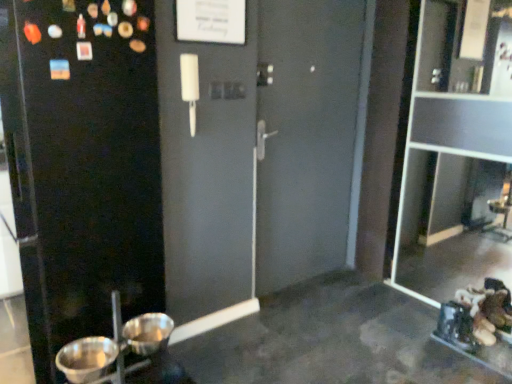
Question: From the image's perspective, does metallic silver basin at lower left, which ranks as the first basin in right-to-left order, appear lower than transparent glass cabinet at right?

Choices:
 (A) yes
 (B) no

Answer: (A)

Question: Is metallic silver basin at lower left, the second basin from the left, oriented away from transparent glass cabinet at right?

Choices:
 (A) yes
 (B) no

Answer: (B)

Question: Is metallic silver basin at lower left, which ranks as the first basin in right-to-left order, far from transparent glass cabinet at right?

Choices:
 (A) yes
 (B) no

Answer: (A)

Question: Is metallic silver basin at lower left, which ranks as the first basin in right-to-left order, at the right side of transparent glass cabinet at right?

Choices:
 (A) no
 (B) yes

Answer: (A)

Question: From a real-world perspective, does metallic silver basin at lower left, which ranks as the first basin in right-to-left order, sit lower than transparent glass cabinet at right?

Choices:
 (A) yes
 (B) no

Answer: (A)

Question: In terms of height, does transparent glass cabinet at right look taller or shorter compared to metallic silver basin at lower left, which appears as the second basin when viewed from the right?

Choices:
 (A) short
 (B) tall

Answer: (B)

Question: Looking at the image, does transparent glass cabinet at right seem bigger or smaller compared to metallic silver basin at lower left, which appears as the second basin when viewed from the right?

Choices:
 (A) big
 (B) small

Answer: (A)

Question: From the image's perspective, relative to metallic silver basin at lower left, which appears as the second basin when viewed from the right, is transparent glass cabinet at right above or below?

Choices:
 (A) below
 (B) above

Answer: (B)

Question: From a real-world perspective, is transparent glass cabinet at right physically located above or below metallic silver basin at lower left, which appears as the second basin when viewed from the right?

Choices:
 (A) above
 (B) below

Answer: (A)

Question: Looking at their shapes, would you say metallic silver basin at lower left, the second basin from the left, is wider or thinner than black matte screen door at left?

Choices:
 (A) wide
 (B) thin

Answer: (B)

Question: Considering the relative positions of metallic silver basin at lower left, the second basin from the left, and black matte screen door at left in the image provided, is metallic silver basin at lower left, the second basin from the left, to the left or to the right of black matte screen door at left?

Choices:
 (A) left
 (B) right

Answer: (B)

Question: Is point (138, 329) positioned closer to the camera than point (121, 1)?

Choices:
 (A) closer
 (B) farther

Answer: (B)

Question: From the image's perspective, is metallic silver basin at lower left, the second basin from the left, above or below black matte screen door at left?

Choices:
 (A) above
 (B) below

Answer: (B)

Question: Is metallic silver basin at lower left, the second basin from the left, taller or shorter than metallic silver basin at lower left, the first basin positioned from the left?

Choices:
 (A) tall
 (B) short

Answer: (B)

Question: From the image's perspective, is metallic silver basin at lower left, which ranks as the first basin in right-to-left order, positioned above or below metallic silver basin at lower left, the first basin positioned from the left?

Choices:
 (A) above
 (B) below

Answer: (A)